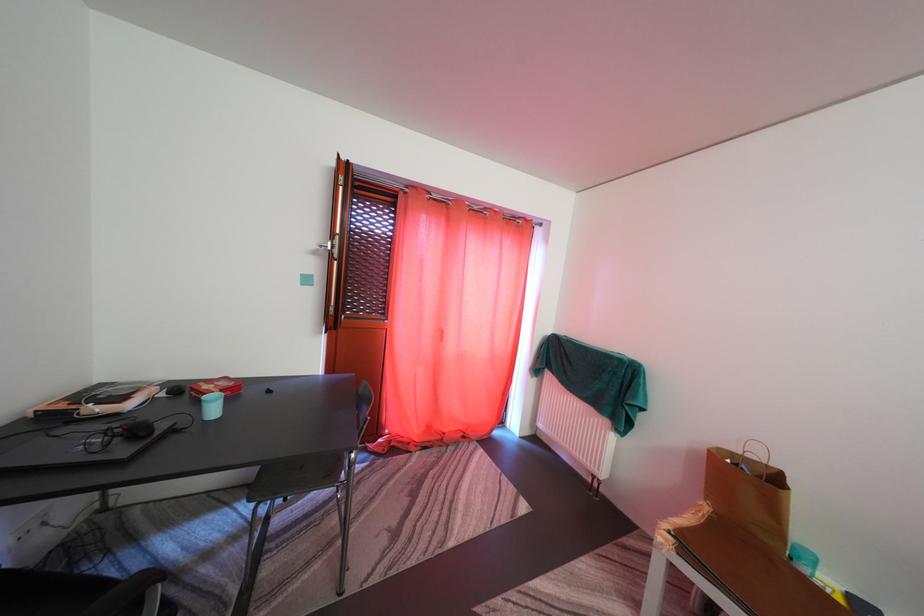
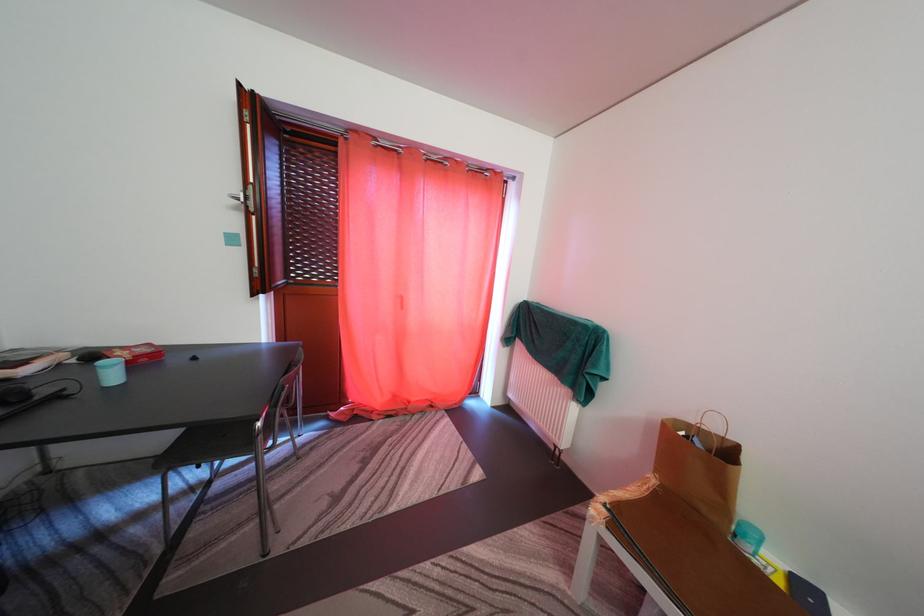
Where in the second image is the point corresponding to point 191,397 from the first image?

(102, 362)